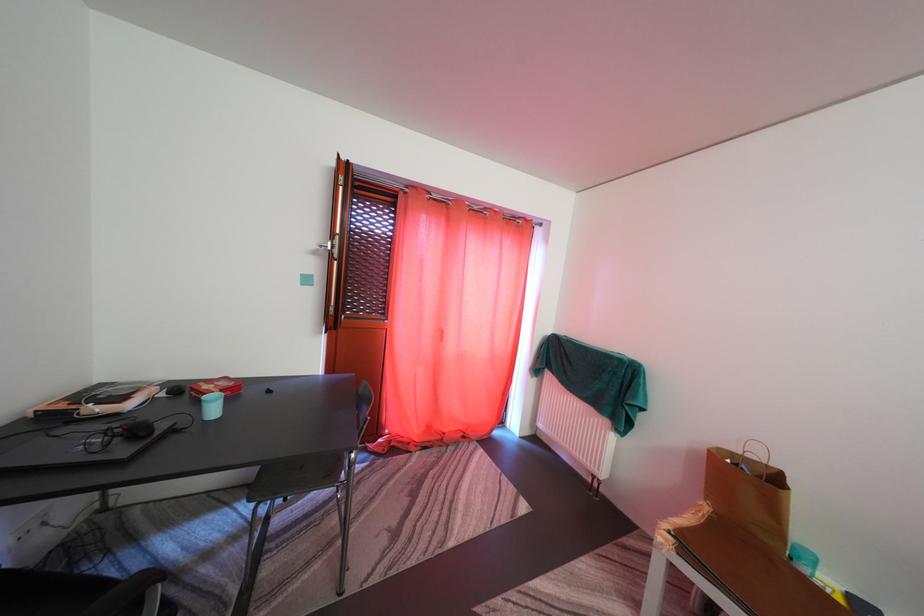
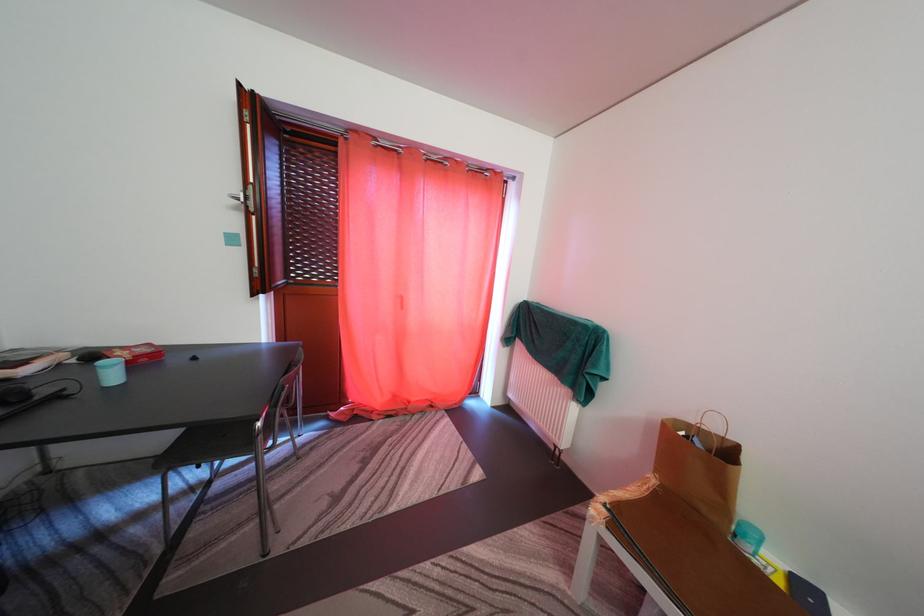
Where in the second image is the point corresponding to point 191,397 from the first image?

(102, 362)